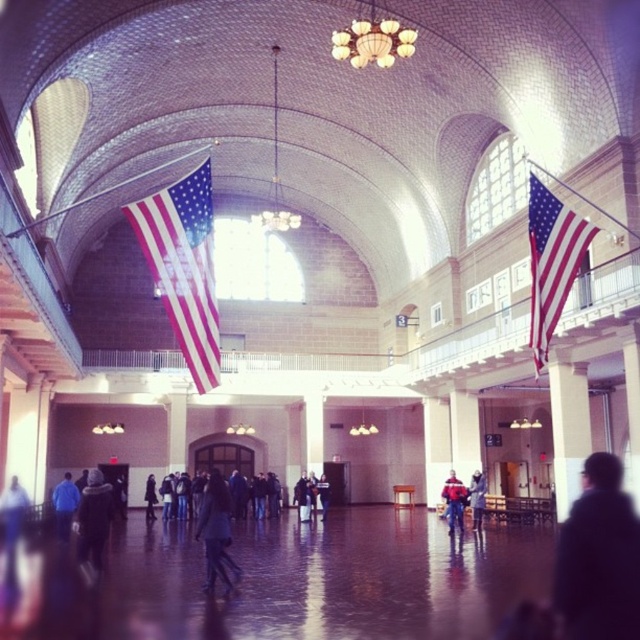
You are standing in the grand historic building and notice two items at the center of the image. Which item is closer to you, the dark blue jacket at center or the dark gray sweater at center?

The dark blue jacket at center is closer to you because it is in front of the dark gray sweater at center.

You are standing in the historic building and want to touch both the matte fabric flag at center and the dark gray jacket at center. Which object should you reach for first to touch the one closer to you?

The matte fabric flag at center is closer to the viewer than the dark gray jacket at center, so you should reach for the matte fabric flag at center first.

You are standing in the grand historic building and see both the dark blue jacket at center and the dark gray sweater at center. Which one is positioned more to the right side of the scene?

The dark blue jacket at center is positioned more to the right side of the scene compared to the dark gray sweater at center.